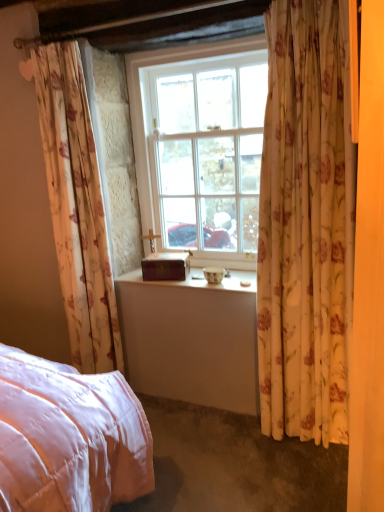
Identify the location of free space in front of floral fabric curtain at right, marked as the 2th curtain in a left-to-right arrangement. The width and height of the screenshot is (384, 512). (306, 472).